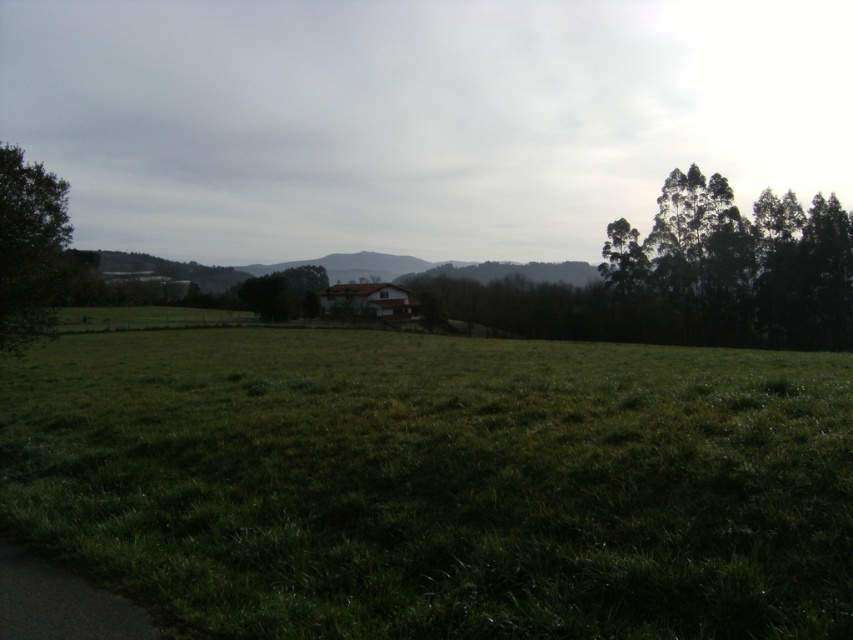
Question: Which object is positioned farthest from the green leafy trees at right?

Choices:
 (A) green grassy field at center
 (B) green leafy tree at left

Answer: (B)

Question: Is green grassy field at center wider than green leafy tree at center?

Choices:
 (A) yes
 (B) no

Answer: (A)

Question: Which of the following is the farthest from the observer?

Choices:
 (A) (283, 316)
 (B) (367, 458)
 (C) (798, 262)

Answer: (A)

Question: Which object appears closest to the camera in this image?

Choices:
 (A) green leafy tree at center
 (B) green leafy tree at left
 (C) green leafy trees at right

Answer: (B)

Question: Can you confirm if green leafy trees at right is positioned below green leafy tree at center?

Choices:
 (A) yes
 (B) no

Answer: (A)

Question: Does green grassy field at center lie behind green leafy tree at center?

Choices:
 (A) yes
 (B) no

Answer: (B)